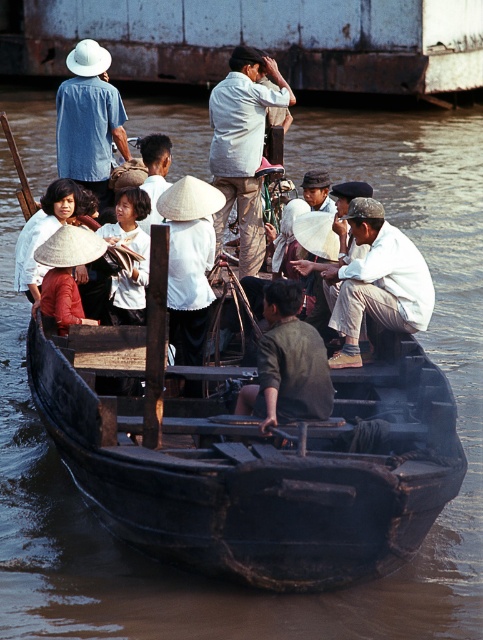
Question: Is white cotton hat at center above white woven hat at center?

Choices:
 (A) no
 (B) yes

Answer: (A)

Question: Can you confirm if black wooden boat at center is wider than dark brown fabric shirt at center?

Choices:
 (A) no
 (B) yes

Answer: (B)

Question: Does black wooden boat at center have a larger size compared to white straw hat at center?

Choices:
 (A) no
 (B) yes

Answer: (B)

Question: Which point is farther from the camera taking this photo?

Choices:
 (A) (184, 244)
 (B) (90, 115)
 (C) (170, 140)

Answer: (C)

Question: Which object is positioned farthest from the light beige cotton shirt at center?

Choices:
 (A) white woven hat at center
 (B) white straw hat at center
 (C) black wooden boat at center

Answer: (C)

Question: Considering the real-world distances, which object is farthest from the black wooden boat at center?

Choices:
 (A) matte blue shirt at upper left
 (B) white woven hat at center

Answer: (A)